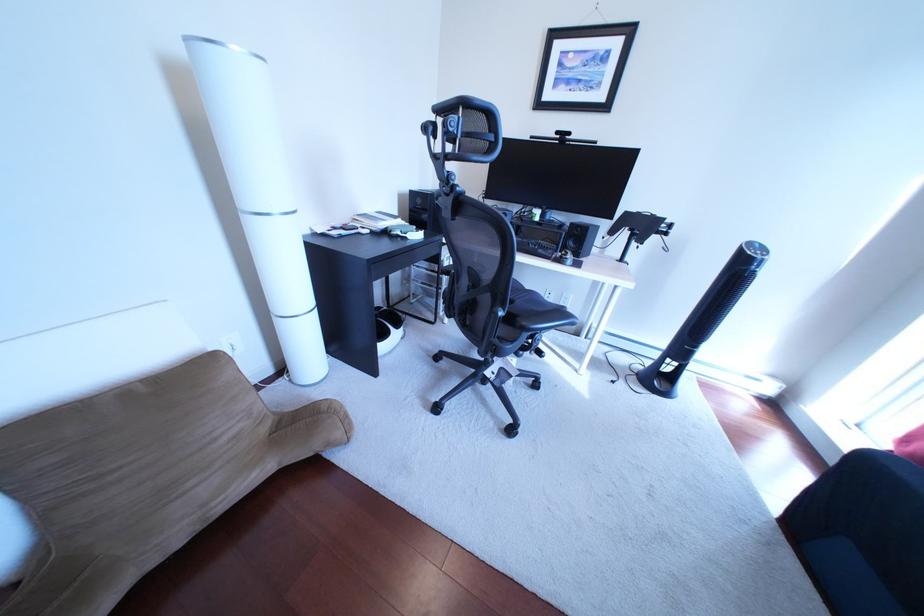
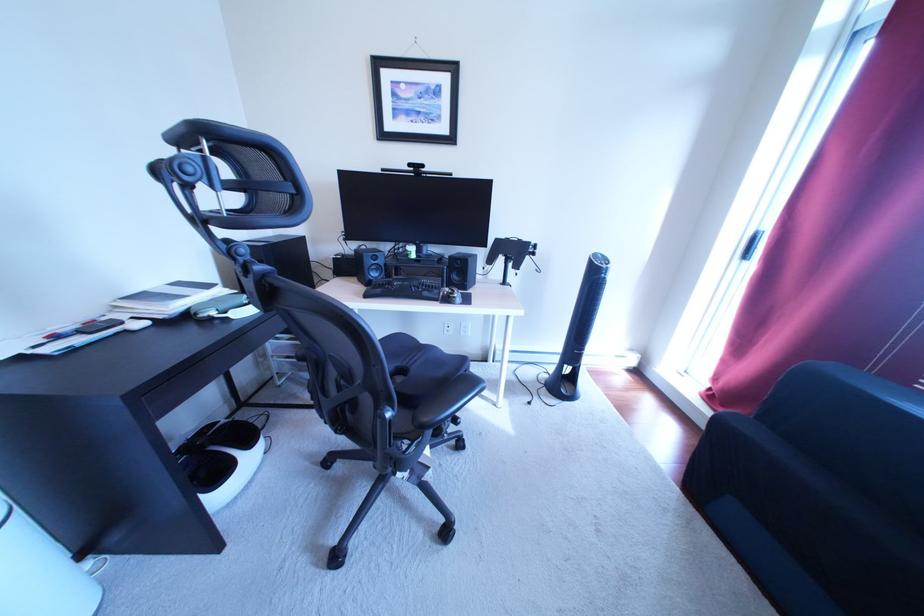
Question: The first image is from the beginning of the video and the second image is from the end. How did the camera likely rotate when shooting the video?

Choices:
 (A) Left
 (B) Right
 (C) Up
 (D) Down

Answer: (B)